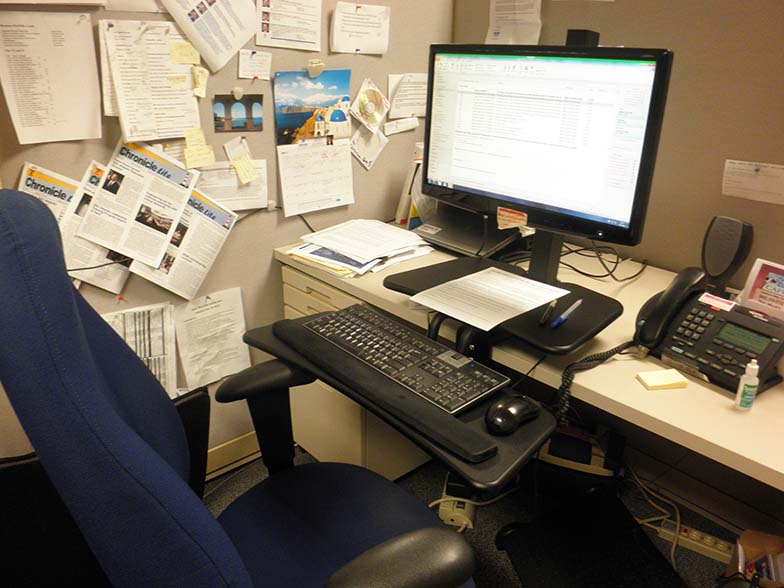
At what (x,y) coordinates should I click in order to perform the action: click on chair. Please return your answer as a coordinate pair (x, y). The width and height of the screenshot is (784, 588). Looking at the image, I should click on (314, 523).